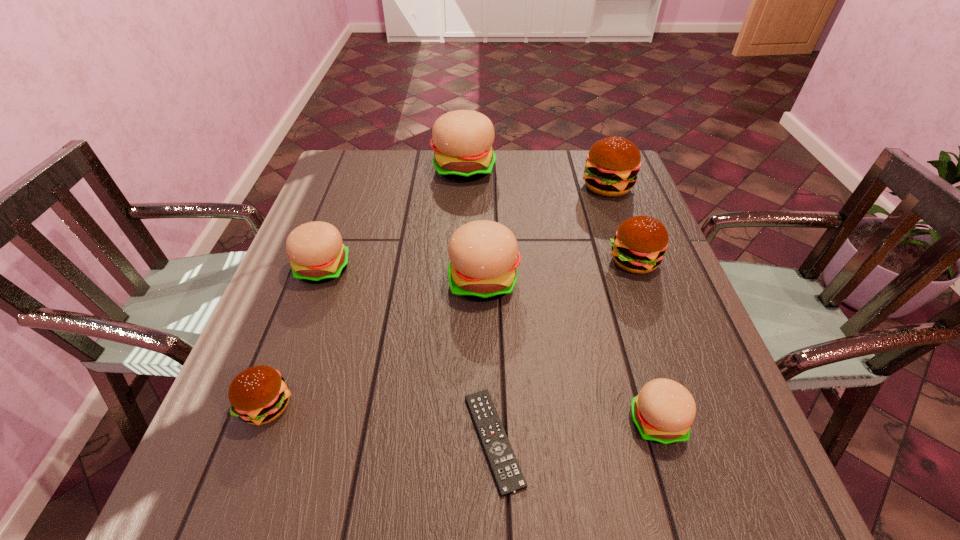
In the image, there is a desktop. Where is `free space at the far edge`? This screenshot has height=540, width=960. free space at the far edge is located at coordinates (407, 168).

Image resolution: width=960 pixels, height=540 pixels. In the image, there is a desktop. In order to click on blank space at the near edge in this screenshot , I will do `click(347, 520)`.

What are the coordinates of `free space at the left edge` in the screenshot? It's located at (335, 220).

In order to click on free location at the right edge in this screenshot , I will do `click(684, 301)`.

The height and width of the screenshot is (540, 960). I want to click on free space at the far left corner of the desktop, so click(x=369, y=157).

Where is `free spot between the second smallest brown hamburger and the nearest brown hamburger`? free spot between the second smallest brown hamburger and the nearest brown hamburger is located at coordinates (450, 333).

In order to click on vacant space that is in between the second farthest brown hamburger and the smallest brown hamburger in this screenshot , I will do `click(450, 333)`.

You are a GUI agent. You are given a task and a screenshot of the screen. Output one action in this format:
    pyautogui.click(x=<x>, y=<y>)
    Task: Click on the vacant point located between the second farthest brown hamburger and the nearest brown hamburger
    
    Given the screenshot: What is the action you would take?
    pyautogui.click(x=450, y=333)

Locate an element on the screen. vacant area that lies between the third smallest beige hamburger and the shortest object is located at coordinates (489, 361).

Identify the location of vacant region between the remote control and the second nearest brown hamburger. (564, 350).